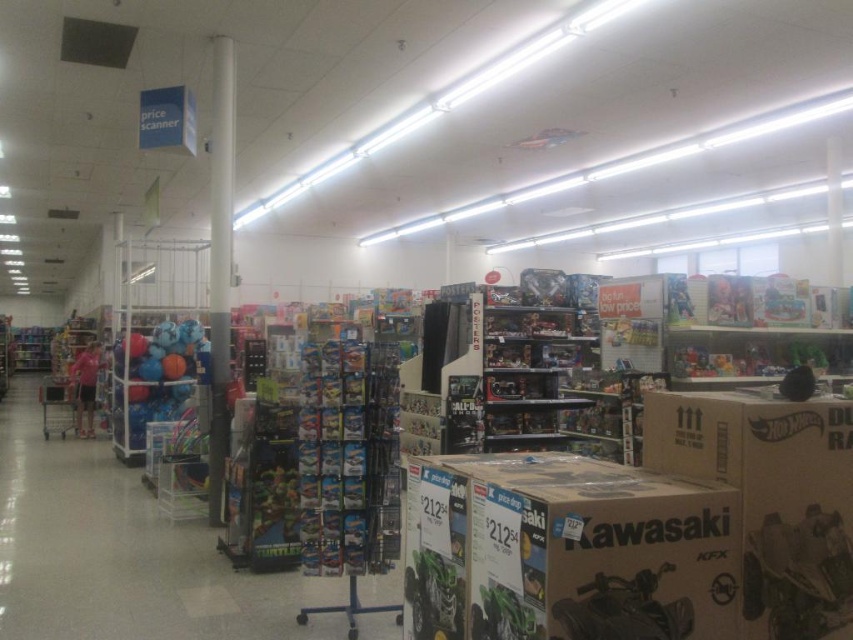
Which is above, white glossy pillar at center or pink fabric shirt at center?

white glossy pillar at center is higher up.

Looking at this image, who is more distant from viewer, (x=213, y=435) or (x=88, y=353)?

Point (x=88, y=353)

At what (x,y) coordinates should I click in order to perform the action: click on white glossy pillar at center. Please return your answer as a coordinate pair (x, y). Looking at the image, I should click on (219, 260).

Does matte blue basketball at left have a lesser width compared to pink fabric shirt at center?

In fact, matte blue basketball at left might be wider than pink fabric shirt at center.

Who is positioned more to the left, matte blue basketball at left or pink fabric shirt at center?

pink fabric shirt at center

What do you see at coordinates (152, 378) in the screenshot? The width and height of the screenshot is (853, 640). I see `matte blue basketball at left` at bounding box center [152, 378].

Identify the location of matte blue basketball at left. The width and height of the screenshot is (853, 640). (152, 378).

Does multicolored plastic toys at left appear on the left side of pink fabric shirt at center?

Incorrect, multicolored plastic toys at left is not on the left side of pink fabric shirt at center.

Which is in front, point (363, 634) or point (80, 435)?

Point (363, 634) is in front.

Locate an element on the screen. multicolored plastic toys at left is located at coordinates (122, 552).